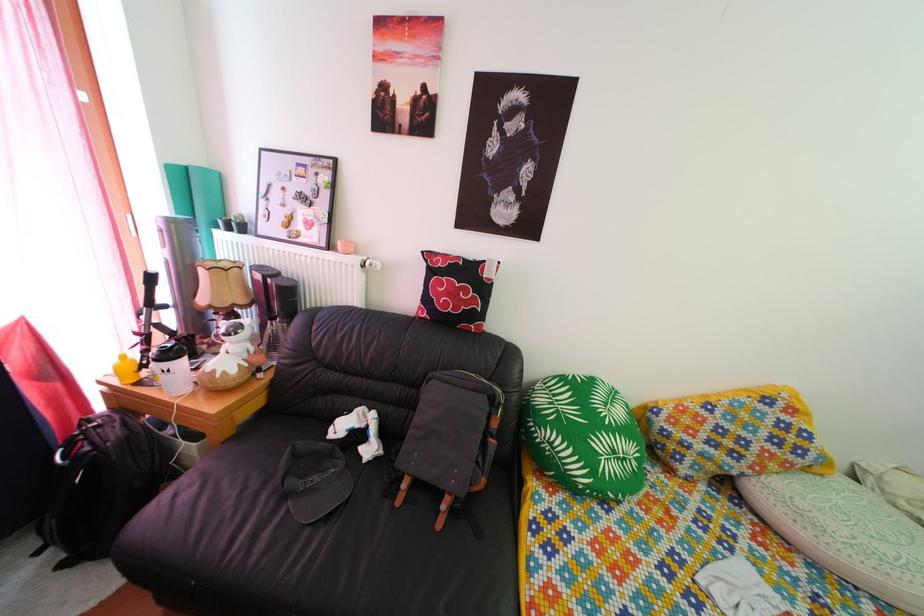
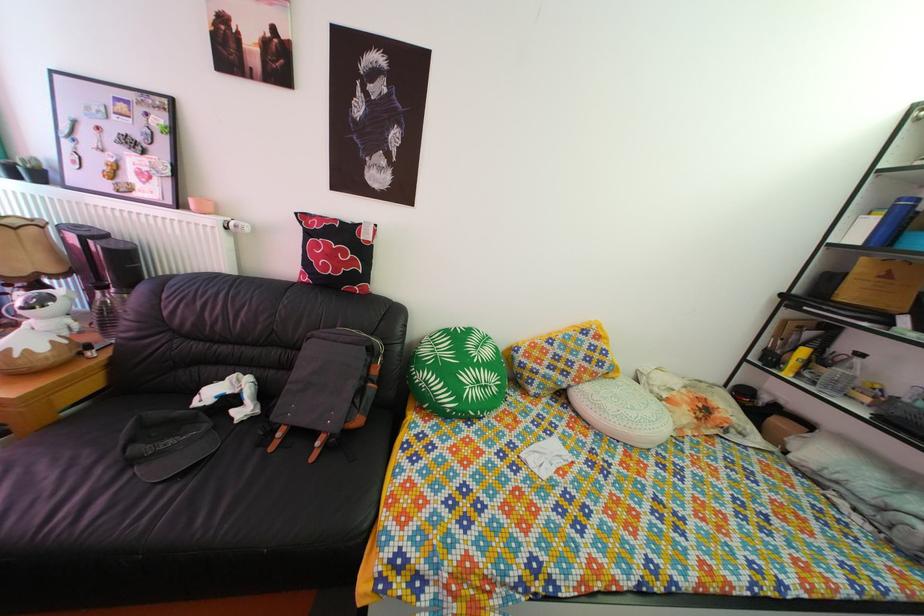
In the second image, find the point that corresponds to (275,325) in the first image.

(103, 294)